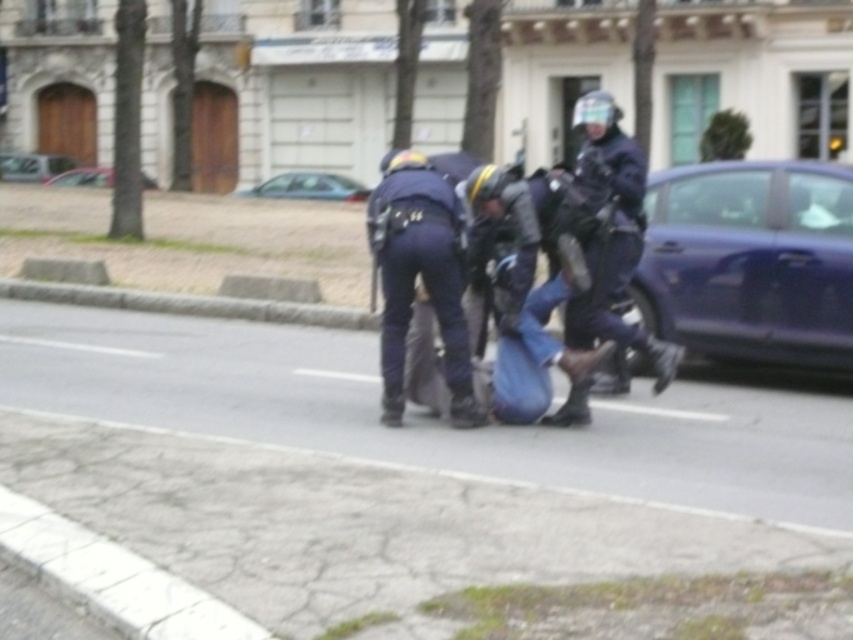
You are a police officer trying to locate two specific points on the sidewalk during a patrol. The first point is at coordinate point [668,173] and the second point is at coordinate point [79,177]. From your vantage point, which of these two points is closer to you?

Point [668,173] is in front of point [79,177], so it is closer to you.

You are a parking attendant trying to fit a new compact car into the available space between the metallic blue sedan at right and the metallic silver car at center. Based on the scene, can the compact car fit in that space?

The metallic blue sedan at right is smaller than the metallic silver car at center, so the space between them may be sufficient for a compact car depending on the exact dimensions. However, without knowing the exact distance between the two vehicles, it is difficult to determine definitively.

You are a delivery driver who needs to park your van near the curb on the sidewalk. There is a point marked at coordinates (750, 260) where a metallic blue sedan at right is parked. Can you park your van there without blocking the metallic blue sedan at right?

The metallic blue sedan at right is parked at point (750, 260), so parking your van there would block the metallic blue sedan at right. Choose another spot.